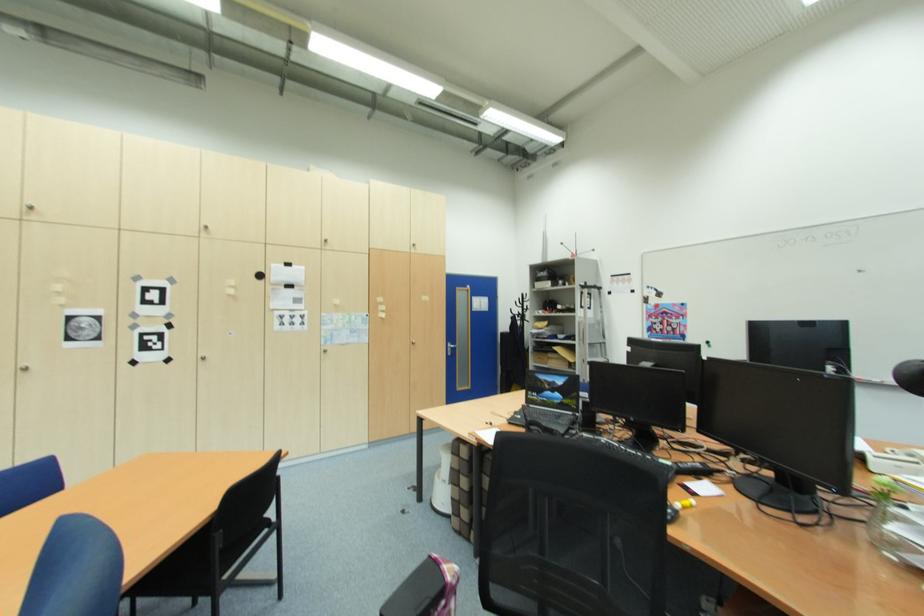
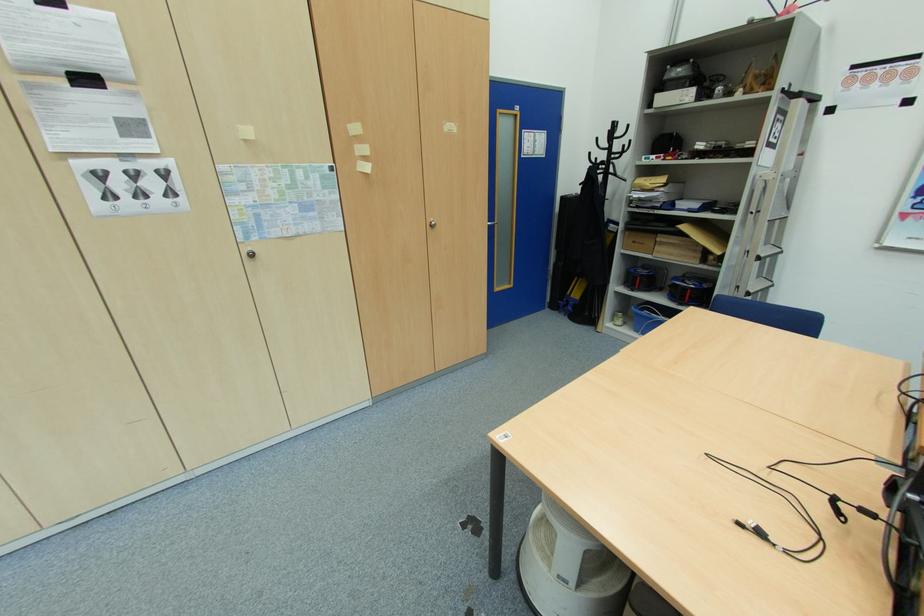
Where in the second image is the point corresponding to pixel 528 301 from the first image?

(619, 136)